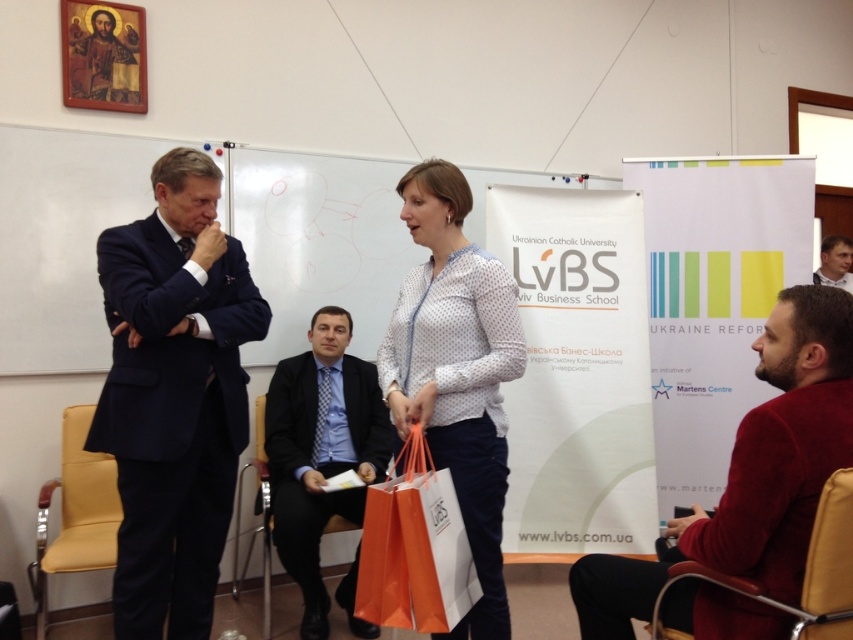
Question: Which point is farther to the camera?

Choices:
 (A) (828, 244)
 (B) (115, 602)

Answer: (A)

Question: Which point is farther to the camera?

Choices:
 (A) (743, 432)
 (B) (135, 552)

Answer: (B)

Question: Does white dotted shirt at center have a smaller size compared to yellow fabric chair at lower left?

Choices:
 (A) yes
 (B) no

Answer: (A)

Question: Which object appears closest to the camera in this image?

Choices:
 (A) dark red sweater at right
 (B) blue textured shirt at center
 (C) white dotted shirt at center
 (D) brown leather chair at lower right

Answer: (D)

Question: Is yellow fabric chair at lower left bigger than black satin business suit at upper right?

Choices:
 (A) no
 (B) yes

Answer: (B)

Question: In this image, where is dark red sweater at right located relative to blue textured shirt at center?

Choices:
 (A) below
 (B) above

Answer: (B)